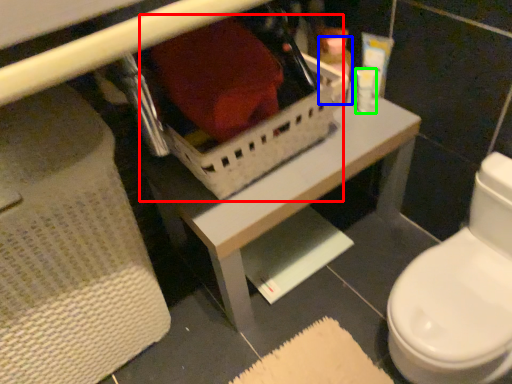
Question: Based on their relative distances, which object is farther from storage box (highlighted by a red box)? Choose from toiletry (highlighted by a blue box) and toiletry (highlighted by a green box).

Choices:
 (A) toiletry
 (B) toiletry

Answer: (B)